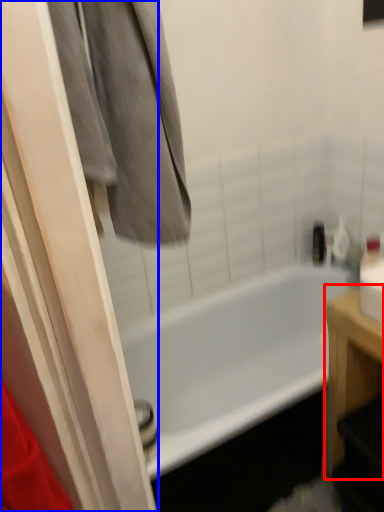
Question: Which of the following is the closest to the observer, furniture (highlighted by a red box) or screen door (highlighted by a blue box)?

Choices:
 (A) furniture
 (B) screen door

Answer: (B)